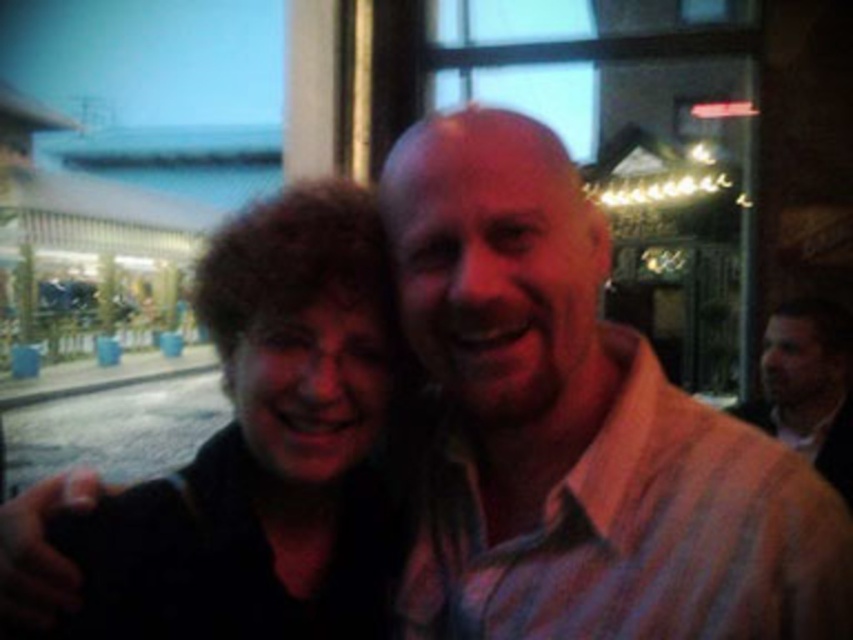
Question: Which point is farther from the camera taking this photo?

Choices:
 (A) (299, 464)
 (B) (840, 420)

Answer: (B)

Question: Does dark brown hair at left have a greater width compared to light brown textured shirt at right?

Choices:
 (A) no
 (B) yes

Answer: (B)

Question: Can you confirm if dark brown hair at left is positioned below light brown textured shirt at right?

Choices:
 (A) yes
 (B) no

Answer: (B)

Question: Which of the following is the farthest from the observer?

Choices:
 (A) dark brown hair at left
 (B) light brown textured shirt at right

Answer: (B)

Question: Does dark brown hair at left appear on the right side of light brown textured shirt at right?

Choices:
 (A) yes
 (B) no

Answer: (B)